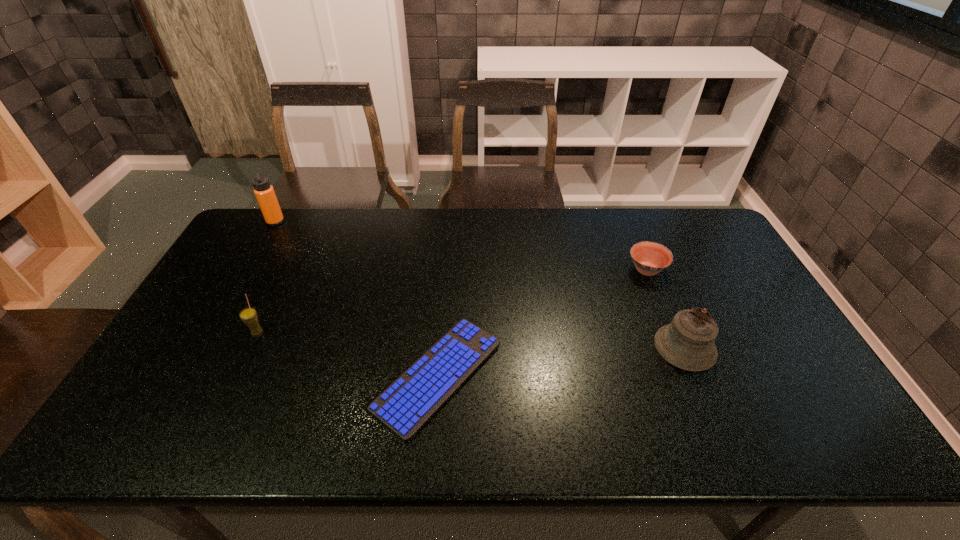
Identify the location of vacant space situated on the back of the bell. The image size is (960, 540). (664, 299).

The width and height of the screenshot is (960, 540). In order to click on vacant space located 0.230m on the right of the fourth object from right to left in this screenshot , I will do `click(348, 332)`.

Image resolution: width=960 pixels, height=540 pixels. Identify the location of vacant area situated on the front of the bowl. (687, 370).

Locate an element on the screen. The width and height of the screenshot is (960, 540). free point located on the right of the third object from left to right is located at coordinates (647, 376).

Find the location of `object present at the far edge`. object present at the far edge is located at coordinates (264, 192).

At what (x,y) coordinates should I click in order to perform the action: click on object at the near edge. Please return your answer as a coordinate pair (x, y). The height and width of the screenshot is (540, 960). Looking at the image, I should click on (414, 398).

Where is `object present at the left edge`? object present at the left edge is located at coordinates (264, 192).

Where is `object that is at the far left corner`? object that is at the far left corner is located at coordinates (264, 192).

Locate an element on the screen. vacant space at the far edge is located at coordinates (421, 210).

Where is `vacant space at the near edge of the desktop`? This screenshot has height=540, width=960. vacant space at the near edge of the desktop is located at coordinates click(240, 436).